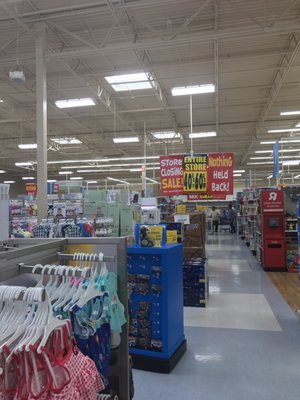
Identify the location of floor. This screenshot has width=300, height=400. (247, 323).